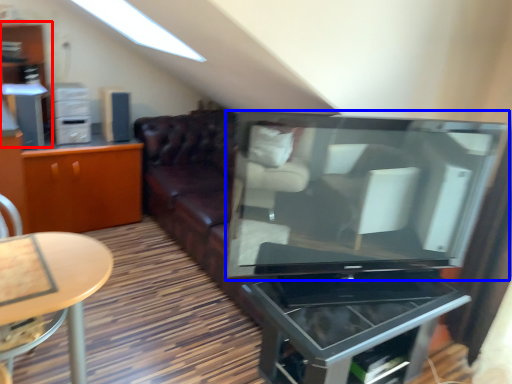
Question: Which object is further to the camera taking this photo, dresser (highlighted by a red box) or television (highlighted by a blue box)?

Choices:
 (A) dresser
 (B) television

Answer: (A)